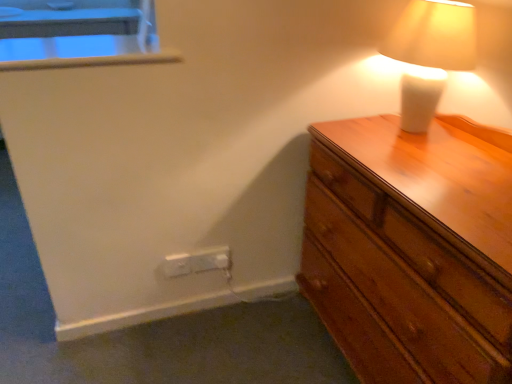
Measure the distance between white plastic electric outlet at lower center, which ranks as the first electric outlet in right-to-left order, and camera.

white plastic electric outlet at lower center, which ranks as the first electric outlet in right-to-left order, and camera are 5.19 feet apart from each other.

Find the location of `wooden chest of drawers at right`. wooden chest of drawers at right is located at coordinates (412, 248).

In order to face white plastic window sill at upper left, should I rotate leftwards or rightwards?

It's best to rotate left around 21.912 degrees.

Locate an element on the screen. This screenshot has height=384, width=512. white plastic electric outlet at lower center, which ranks as the first electric outlet in right-to-left order is located at coordinates (210, 260).

Which of these two, white plastic electric outlet at lower center, which ranks as the first electric outlet in right-to-left order, or white plastic electric outlet at lower left, the first electric outlet from the left, is bigger?

Bigger between the two is white plastic electric outlet at lower center, which ranks as the first electric outlet in right-to-left order.

Is white plastic electric outlet at lower center, the second electric outlet positioned from the left, positioned far away from white plastic electric outlet at lower left, the first electric outlet from the left?

No, white plastic electric outlet at lower center, the second electric outlet positioned from the left, is in close proximity to white plastic electric outlet at lower left, the first electric outlet from the left.

Is white plastic electric outlet at lower center, which ranks as the first electric outlet in right-to-left order, to the left or to the right of white plastic electric outlet at lower left, which ranks as the 2th electric outlet in right-to-left order, in the image?

Clearly, white plastic electric outlet at lower center, which ranks as the first electric outlet in right-to-left order, is on the right of white plastic electric outlet at lower left, which ranks as the 2th electric outlet in right-to-left order, in the image.

You are a GUI agent. You are given a task and a screenshot of the screen. Output one action in this format:
    pyautogui.click(x=<x>, y=<y>)
    Task: Click on the electric outlet that appears below the white plastic electric outlet at lower center, the second electric outlet positioned from the left (from the image's perspective)
    
    Given the screenshot: What is the action you would take?
    pyautogui.click(x=176, y=265)

From a real-world perspective, is white plastic window sill at upper left positioned under white ceramic lamp at upper right based on gravity?

Actually, white plastic window sill at upper left is physically above white ceramic lamp at upper right in the real world.

Is white plastic window sill at upper left taller or shorter than white ceramic lamp at upper right?

In the image, white plastic window sill at upper left appears to be shorter than white ceramic lamp at upper right.

Which is in front, point (117, 55) or point (400, 29)?

The point (400, 29) is closer to the camera.

Is wooden chest of drawers at right looking in the opposite direction of white plastic electric outlet at lower center, the second electric outlet positioned from the left?

No, wooden chest of drawers at right's orientation is not away from white plastic electric outlet at lower center, the second electric outlet positioned from the left.

Considering the sizes of wooden chest of drawers at right and white plastic electric outlet at lower center, the second electric outlet positioned from the left, in the image, is wooden chest of drawers at right wider or thinner than white plastic electric outlet at lower center, the second electric outlet positioned from the left,?

Clearly, wooden chest of drawers at right has more width compared to white plastic electric outlet at lower center, the second electric outlet positioned from the left.

In the scene shown: Can you confirm if wooden chest of drawers at right is positioned to the right of white plastic electric outlet at lower center, the second electric outlet positioned from the left?

Correct, you'll find wooden chest of drawers at right to the right of white plastic electric outlet at lower center, the second electric outlet positioned from the left.

Can white plastic electric outlet at lower center, the second electric outlet positioned from the left, be found inside wooden chest of drawers at right?

No, white plastic electric outlet at lower center, the second electric outlet positioned from the left, is not inside wooden chest of drawers at right.

From the picture: Would you say wooden chest of drawers at right is inside or outside white plastic window sill at upper left?

wooden chest of drawers at right is located beyond the bounds of white plastic window sill at upper left.

Looking at this image, considering the positions of objects wooden chest of drawers at right and white plastic window sill at upper left in the image provided, who is more to the left, wooden chest of drawers at right or white plastic window sill at upper left?

Positioned to the left is white plastic window sill at upper left.

Considering the positions of objects wooden chest of drawers at right and white plastic window sill at upper left in the image provided, who is in front, wooden chest of drawers at right or white plastic window sill at upper left?

wooden chest of drawers at right is in front.

Based on their sizes in the image, would you say wooden chest of drawers at right is bigger or smaller than white plastic window sill at upper left?

In the image, wooden chest of drawers at right appears to be larger than white plastic window sill at upper left.

From the image's perspective, is white ceramic lamp at upper right above or below wooden chest of drawers at right?

Based on their image positions, white ceramic lamp at upper right is located above wooden chest of drawers at right.

Can you confirm if white ceramic lamp at upper right is positioned to the left of wooden chest of drawers at right?

Yes, white ceramic lamp at upper right is to the left of wooden chest of drawers at right.

Are white ceramic lamp at upper right and wooden chest of drawers at right beside each other?

No, white ceramic lamp at upper right is not making contact with wooden chest of drawers at right.

Is white plastic window sill at upper left thinner than white plastic electric outlet at lower left, which ranks as the 2th electric outlet in right-to-left order?

No, white plastic window sill at upper left is not thinner than white plastic electric outlet at lower left, which ranks as the 2th electric outlet in right-to-left order.

From a real-world perspective, is white plastic window sill at upper left positioned above or below white plastic electric outlet at lower left, the first electric outlet from the left?

Clearly, from a real-world perspective, white plastic window sill at upper left is above white plastic electric outlet at lower left, the first electric outlet from the left.

In the image, is white plastic window sill at upper left positioned in front of or behind white plastic electric outlet at lower left, which ranks as the 2th electric outlet in right-to-left order?

Visually, white plastic window sill at upper left is located in front of white plastic electric outlet at lower left, which ranks as the 2th electric outlet in right-to-left order.

Does point (103, 56) come in front of point (179, 266)?

Yes, point (103, 56) is closer to viewer.

From the image's perspective, which is below, white plastic electric outlet at lower left, which ranks as the 2th electric outlet in right-to-left order, or white plastic window sill at upper left?

white plastic electric outlet at lower left, which ranks as the 2th electric outlet in right-to-left order, is shown below in the image.

Looking at this image, between white plastic electric outlet at lower left, the first electric outlet from the left, and white plastic window sill at upper left, which one has larger width?

white plastic window sill at upper left is wider.

Can you confirm if white plastic electric outlet at lower left, the first electric outlet from the left, is positioned to the right of white plastic window sill at upper left?

Indeed, white plastic electric outlet at lower left, the first electric outlet from the left, is positioned on the right side of white plastic window sill at upper left.

From a real-world perspective, who is located lower, white plastic electric outlet at lower left, the first electric outlet from the left, or white plastic window sill at upper left?

white plastic electric outlet at lower left, the first electric outlet from the left, is physically lower.

The image size is (512, 384). What are the coordinates of `electric outlet in front of the white plastic electric outlet at lower center, the second electric outlet positioned from the left` in the screenshot? It's located at (176, 265).

Locate an element on the screen. lamp below the white plastic window sill at upper left (from the image's perspective) is located at coordinates (430, 54).

Considering their positions, is wooden chest of drawers at right positioned closer to white plastic electric outlet at lower center, the second electric outlet positioned from the left, than white plastic electric outlet at lower left, which ranks as the 2th electric outlet in right-to-left order?

white plastic electric outlet at lower left, which ranks as the 2th electric outlet in right-to-left order, is closer to white plastic electric outlet at lower center, the second electric outlet positioned from the left.

Considering their positions, is white plastic electric outlet at lower center, which ranks as the first electric outlet in right-to-left order, positioned closer to white ceramic lamp at upper right than white plastic electric outlet at lower left, which ranks as the 2th electric outlet in right-to-left order?

white plastic electric outlet at lower center, which ranks as the first electric outlet in right-to-left order, is closer to white ceramic lamp at upper right.

When comparing their distances from wooden chest of drawers at right, does white plastic electric outlet at lower center, the second electric outlet positioned from the left, or white plastic window sill at upper left seem further?

white plastic window sill at upper left lies further to wooden chest of drawers at right than the other object.

Based on their spatial positions, is white plastic electric outlet at lower center, which ranks as the first electric outlet in right-to-left order, or white ceramic lamp at upper right further from white plastic electric outlet at lower left, the first electric outlet from the left?

Among the two, white ceramic lamp at upper right is located further to white plastic electric outlet at lower left, the first electric outlet from the left.

Which object lies nearer to the anchor point white ceramic lamp at upper right, wooden chest of drawers at right or white plastic electric outlet at lower left, the first electric outlet from the left?

wooden chest of drawers at right.

From the image, which object appears to be farther from wooden chest of drawers at right, white plastic electric outlet at lower center, the second electric outlet positioned from the left, or white plastic electric outlet at lower left, which ranks as the 2th electric outlet in right-to-left order?

white plastic electric outlet at lower left, which ranks as the 2th electric outlet in right-to-left order, is positioned further to the anchor wooden chest of drawers at right.

From the image, which object appears to be nearer to white ceramic lamp at upper right, white plastic window sill at upper left or white plastic electric outlet at lower left, which ranks as the 2th electric outlet in right-to-left order?

The object closer to white ceramic lamp at upper right is white plastic window sill at upper left.

Estimate the real-world distances between objects in this image. Which object is closer to white plastic electric outlet at lower center, which ranks as the first electric outlet in right-to-left order, white plastic window sill at upper left or white ceramic lamp at upper right?

Among the two, white plastic window sill at upper left is located nearer to white plastic electric outlet at lower center, which ranks as the first electric outlet in right-to-left order.

Find the location of `electric outlet between white plastic window sill at upper left and white plastic electric outlet at lower left, which ranks as the 2th electric outlet in right-to-left order, from top to bottom`. electric outlet between white plastic window sill at upper left and white plastic electric outlet at lower left, which ranks as the 2th electric outlet in right-to-left order, from top to bottom is located at coordinates (210, 260).

Locate an element on the screen. lamp between white plastic window sill at upper left and wooden chest of drawers at right in the horizontal direction is located at coordinates (430, 54).

At what (x,y) coordinates should I click in order to perform the action: click on lamp located between white plastic electric outlet at lower left, which ranks as the 2th electric outlet in right-to-left order, and wooden chest of drawers at right in the left-right direction. Please return your answer as a coordinate pair (x, y). The height and width of the screenshot is (384, 512). Looking at the image, I should click on click(430, 54).

The width and height of the screenshot is (512, 384). I want to click on electric outlet positioned between wooden chest of drawers at right and white plastic electric outlet at lower center, the second electric outlet positioned from the left, from near to far, so click(x=176, y=265).